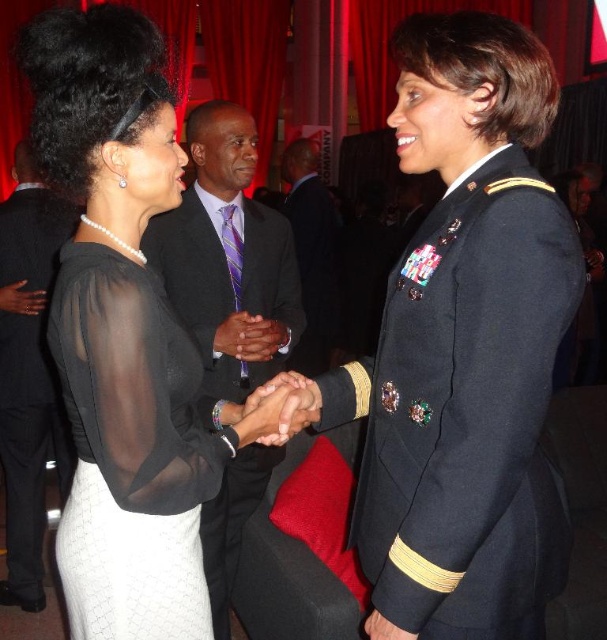
Question: Among these points, which one is farthest from the camera?

Choices:
 (A) (398, 625)
 (B) (310, 212)
 (C) (75, 353)

Answer: (B)

Question: Is navy blue fabric military uniform at center below sheer black blouse at center?

Choices:
 (A) no
 (B) yes

Answer: (A)

Question: Among these points, which one is farthest from the camera?

Choices:
 (A) (214, 209)
 (B) (112, 172)

Answer: (A)

Question: Is navy blue fabric military uniform at center above black pinstripe suit at center?

Choices:
 (A) yes
 (B) no

Answer: (A)

Question: Is black sheer blouse at center further to the viewer compared to black pinstripe suit at center?

Choices:
 (A) yes
 (B) no

Answer: (B)

Question: Which object is closer to the camera taking this photo?

Choices:
 (A) sheer black blouse at center
 (B) dark suit at center
 (C) matte black suit at center

Answer: (A)